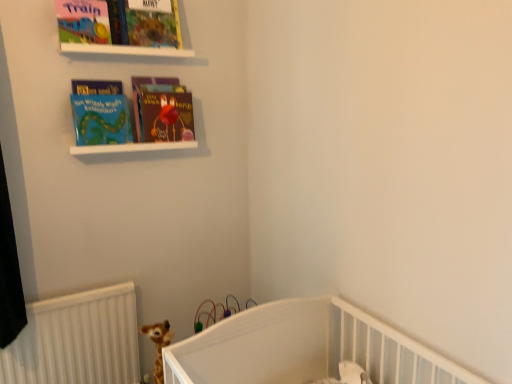
Question: From the image's perspective, is white matte shelf at upper center above or below matte hardcover book at center, acting as the first book starting from the right?

Choices:
 (A) below
 (B) above

Answer: (A)

Question: Choose the correct answer: Is white matte shelf at upper center inside matte hardcover book at center, acting as the first book starting from the right, or outside it?

Choices:
 (A) outside
 (B) inside

Answer: (A)

Question: Considering the real-world distances, which object is closest to the matte blue book at upper left, which appears as the first book when viewed from the left?

Choices:
 (A) matte board book at upper left, the 2th book cover in the right-to-left sequence
 (B) white matte shelf at upper center
 (C) matte hardcover book at center, acting as the first book starting from the right
 (D) matte colorful book at upper center, which is counted as the 1th book cover, starting from the right

Answer: (B)

Question: Which object is the farthest from the white matte shelf at upper center?

Choices:
 (A) matte blue book at upper left, which appears as the 2th book when viewed from the right
 (B) matte hardcover book at center, which is the second book in left-to-right order
 (C) matte board book at upper left, the 2th book cover in the right-to-left sequence
 (D) matte colorful book at upper center, which is counted as the 1th book cover, starting from the right

Answer: (D)